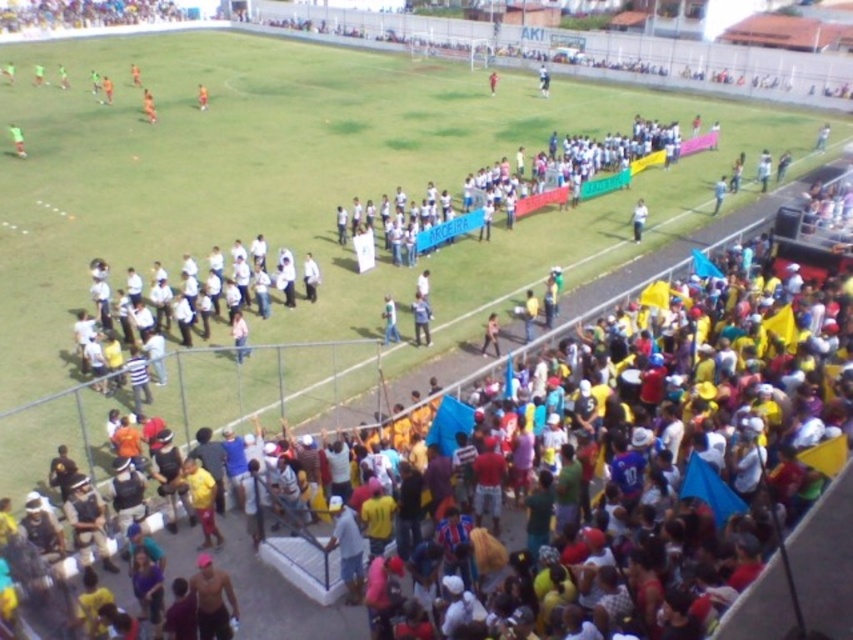
Can you confirm if blue fabric shirt at center is smaller than matte white shirt at center?

No, blue fabric shirt at center is not smaller than matte white shirt at center.

Locate an element on the screen. Image resolution: width=853 pixels, height=640 pixels. blue fabric shirt at center is located at coordinates [x=389, y=321].

Who is more distant from viewer, (387, 316) or (146, 104)?

The point (146, 104) is more distant.

Which is below, blue fabric shirt at center or orange jersey at upper left?

blue fabric shirt at center

What do you see at coordinates (389, 321) in the screenshot?
I see `blue fabric shirt at center` at bounding box center [389, 321].

At what (x,y) coordinates should I click in order to perform the action: click on blue fabric shirt at center. Please return your answer as a coordinate pair (x, y). The width and height of the screenshot is (853, 640). Looking at the image, I should click on (389, 321).

Does matte white shirt at center have a lesser width compared to matte green jersey at upper left?

Indeed, matte white shirt at center has a lesser width compared to matte green jersey at upper left.

Can you confirm if matte white shirt at center is positioned below matte green jersey at upper left?

Correct, matte white shirt at center is located below matte green jersey at upper left.

Does point (631, 212) come farther from viewer compared to point (21, 150)?

No, (631, 212) is in front of (21, 150).

Where is `matte white shirt at center`? The image size is (853, 640). matte white shirt at center is located at coordinates (637, 220).